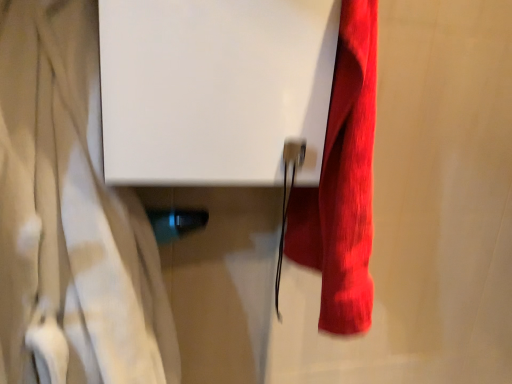
The image size is (512, 384). In order to click on white matte screen door at upper center in this screenshot , I will do `click(214, 89)`.

What do you see at coordinates (214, 89) in the screenshot?
I see `white matte screen door at upper center` at bounding box center [214, 89].

Locate an element on the screen. Image resolution: width=512 pixels, height=384 pixels. white matte screen door at upper center is located at coordinates (214, 89).